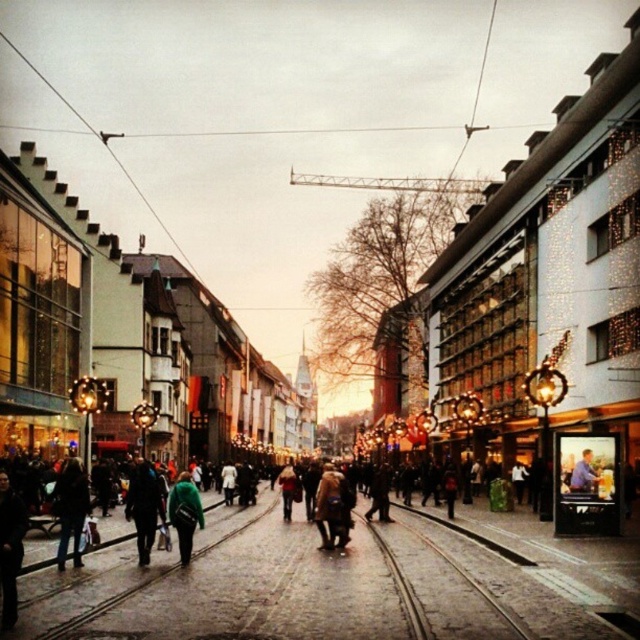
You are a photographer standing in the middle of the street, aiming to capture both the dark blue jacket at lower left and the dark blue jacket at center in a single frame. Which jacket should you focus on to ensure both are in the shot without moving the camera?

The dark blue jacket at lower left is smaller than the dark blue jacket at center, so focusing on the larger jacket at center will help ensure both are visible in the frame.

You are a pedestrian standing on the cobblestone street and see both the dark gray coat at lower left and the green fabric jacket at center. Which one is closer to you?

The dark gray coat at lower left is closer to you because it is in front of the green fabric jacket at center.